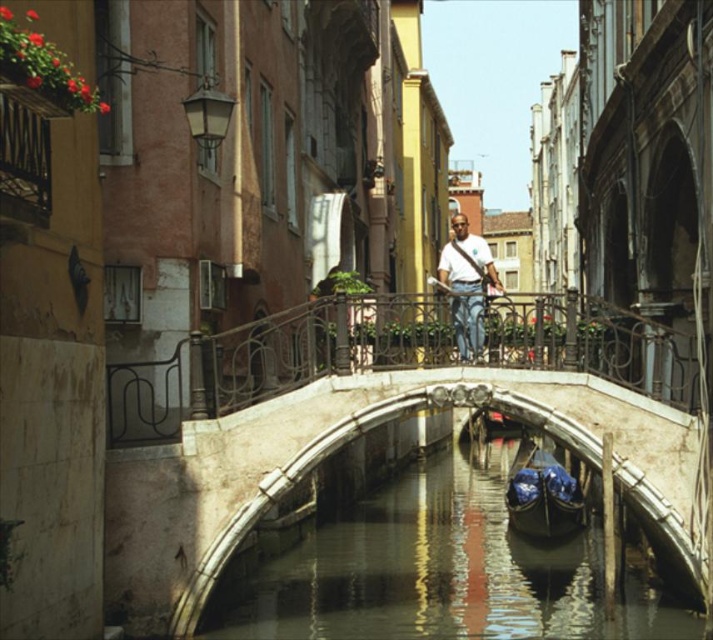
You are a tourist standing at the entrance of the canal and want to cross to the other side. The bridge is located at the center. Can you confirm if the metallic iron bridge at center is the only bridge available to cross the canal?

The metallic iron bridge at center is the only bridge available to cross the canal since there are no other bridges mentioned in the scene description.

You are standing at the point labeled point (272,360) in the image. What object are you standing on?

You are standing on the metallic iron bridge at center.